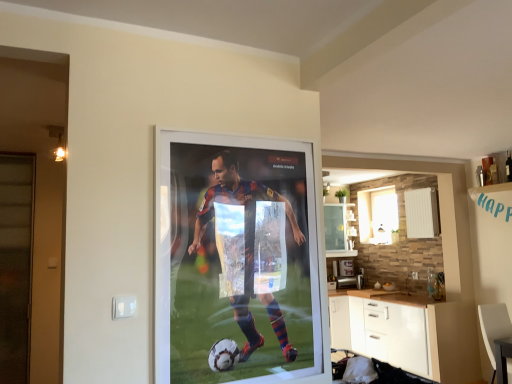
Question: Would you say white frosted glass window at upper right contains translucent glass screen door at left?

Choices:
 (A) yes
 (B) no

Answer: (B)

Question: Considering the relative sizes of white frosted glass window at upper right and translucent glass screen door at left in the image provided, is white frosted glass window at upper right taller than translucent glass screen door at left?

Choices:
 (A) yes
 (B) no

Answer: (B)

Question: Can you confirm if white frosted glass window at upper right is positioned to the left of translucent glass screen door at left?

Choices:
 (A) yes
 (B) no

Answer: (B)

Question: Is white frosted glass window at upper right far away from translucent glass screen door at left?

Choices:
 (A) yes
 (B) no

Answer: (A)

Question: From the image's perspective, is white frosted glass window at upper right under translucent glass screen door at left?

Choices:
 (A) yes
 (B) no

Answer: (B)

Question: From a real-world perspective, is translucent glass screen door at left above or below white matte cabinet at lower right?

Choices:
 (A) above
 (B) below

Answer: (A)

Question: From the image's perspective, is translucent glass screen door at left located above or below white matte cabinet at lower right?

Choices:
 (A) above
 (B) below

Answer: (A)

Question: Does point (25, 352) appear closer or farther from the camera than point (354, 350)?

Choices:
 (A) farther
 (B) closer

Answer: (B)

Question: Relative to white matte cabinet at lower right, is translucent glass screen door at left in front or behind?

Choices:
 (A) front
 (B) behind

Answer: (A)

Question: Is white frosted glass window at upper right bigger or smaller than white leather armchair at lower right?

Choices:
 (A) big
 (B) small

Answer: (B)

Question: Is point (370, 206) closer or farther from the camera than point (508, 357)?

Choices:
 (A) farther
 (B) closer

Answer: (A)

Question: Is white frosted glass window at upper right wider or thinner than white leather armchair at lower right?

Choices:
 (A) wide
 (B) thin

Answer: (B)

Question: From the image's perspective, relative to white leather armchair at lower right, is white frosted glass window at upper right above or below?

Choices:
 (A) above
 (B) below

Answer: (A)

Question: Based on their sizes in the image, would you say white matte cabinet at lower right is bigger or smaller than white leather armchair at lower right?

Choices:
 (A) small
 (B) big

Answer: (B)

Question: Considering the positions of white matte cabinet at lower right and white leather armchair at lower right in the image, is white matte cabinet at lower right taller or shorter than white leather armchair at lower right?

Choices:
 (A) tall
 (B) short

Answer: (A)